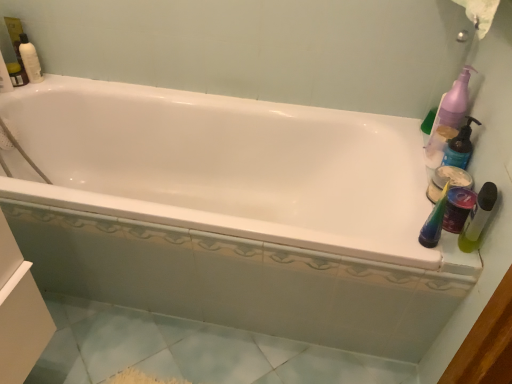
Question: Is green matte bottle at right, placed as the 1th mouthwash when sorted from front to back, at the back of matte white container at right, which is the second cleaning product from top to bottom?

Choices:
 (A) yes
 (B) no

Answer: (B)

Question: Is green matte bottle at right, placed as the 1th mouthwash when sorted from front to back, completely or partially inside matte white container at right, which is the second cleaning product from top to bottom?

Choices:
 (A) yes
 (B) no

Answer: (B)

Question: Is matte white container at right, which is the second cleaning product from top to bottom, at the left side of green matte bottle at right, marked as the 2th mouthwash in a back-to-front arrangement?

Choices:
 (A) no
 (B) yes

Answer: (A)

Question: Is matte white container at right, arranged as the 1th cleaning product when ordered from the bottom, shorter than green matte bottle at right, marked as the 2th mouthwash in a back-to-front arrangement?

Choices:
 (A) yes
 (B) no

Answer: (B)

Question: From a real-world perspective, is matte white container at right, arranged as the 1th cleaning product when ordered from the bottom, over green matte bottle at right, marked as the 2th mouthwash in a back-to-front arrangement?

Choices:
 (A) yes
 (B) no

Answer: (A)

Question: From the image's perspective, is matte white container at right, which is the second cleaning product from top to bottom, on green matte bottle at right, placed as the 1th mouthwash when sorted from front to back?

Choices:
 (A) yes
 (B) no

Answer: (A)

Question: Does green matte bottle at right, marked as the 2th mouthwash in a back-to-front arrangement, have a larger size compared to matte white container at right, arranged as the 1th cleaning product when ordered from the bottom?

Choices:
 (A) no
 (B) yes

Answer: (A)

Question: Is green matte bottle at right, placed as the 1th mouthwash when sorted from front to back, oriented towards matte white container at right, arranged as the 1th cleaning product when ordered from the bottom?

Choices:
 (A) no
 (B) yes

Answer: (A)

Question: Can you confirm if green matte bottle at right, placed as the 1th mouthwash when sorted from front to back, is thinner than matte white container at right, arranged as the 1th cleaning product when ordered from the bottom?

Choices:
 (A) yes
 (B) no

Answer: (A)

Question: Is green matte bottle at right, placed as the 1th mouthwash when sorted from front to back, taller than matte white container at right, which is the second cleaning product from top to bottom?

Choices:
 (A) yes
 (B) no

Answer: (B)

Question: Is matte white container at right, arranged as the 1th cleaning product when ordered from the bottom, at the back of green matte bottle at right, placed as the 1th mouthwash when sorted from front to back?

Choices:
 (A) no
 (B) yes

Answer: (A)

Question: Is green matte bottle at right, placed as the 1th mouthwash when sorted from front to back, positioned in front of matte white container at right, arranged as the 1th cleaning product when ordered from the bottom?

Choices:
 (A) yes
 (B) no

Answer: (A)

Question: From a real-world perspective, is white glossy bathtub at center under matte white container at right, arranged as the 1th cleaning product when ordered from the bottom?

Choices:
 (A) no
 (B) yes

Answer: (B)